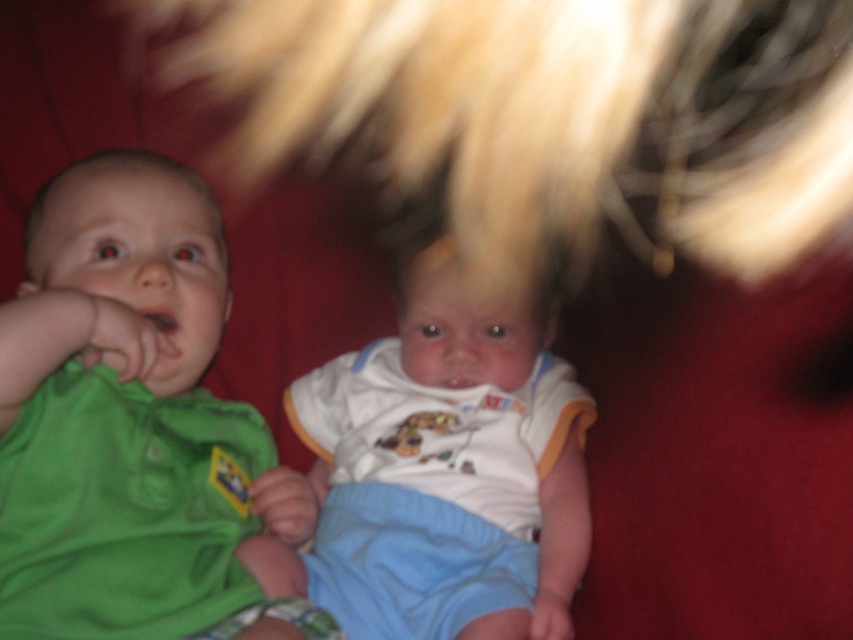
You are a photographer trying to capture a closeup of the green fabric baby at left and the white cotton onesie at center. Since the background is blurred, which baby will be more in focus?

The green fabric baby at left is in front of the white cotton onesie at center, so the green fabric baby at left will be more in focus since it is closer to the camera.

You are a photographer trying to capture a closeup shot of the green fabric baby at left and the white cotton onesie at center. Since the background is blurred, you need to adjust the camera focus. Which baby should you focus on to ensure both are in focus?

The green fabric baby at left is above the white cotton onesie at center, so focusing on the green fabric baby at left will ensure both are in focus as they are positioned vertically aligned.

You are a photographer adjusting your camera settings. You notice two points in the image at coordinates point (202,244) and point (544,504). Which point should you focus on to ensure the closest object is sharp?

Point (202,244) is closer to the camera than point (544,504), so you should focus on point (202,244) to ensure the closest object is sharp.